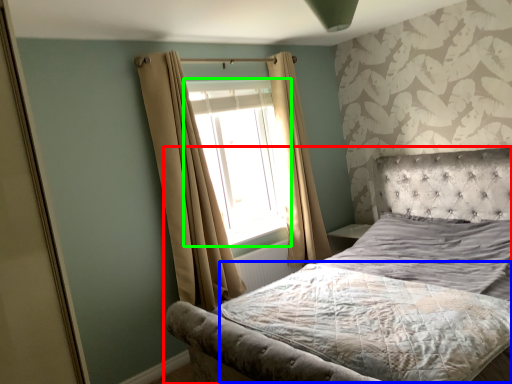
Question: Estimate the real-world distances between objects in this image. Which object is farther from bed (highlighted by a red box), mattress (highlighted by a blue box) or window (highlighted by a green box)?

Choices:
 (A) mattress
 (B) window

Answer: (B)